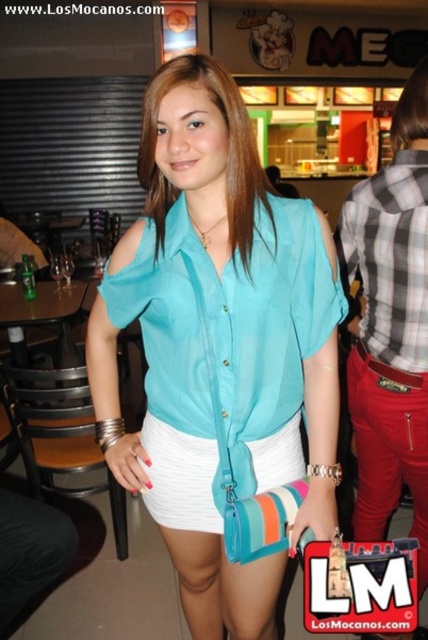
You are a fashion designer observing the image. You need to determine which fabric item is narrower between the plaid fabric shirt at right and the white fabric at center. Which one is narrower?

The plaid fabric shirt at right is narrower than the white fabric at center because it has a lesser width compared to the white fabric at center.

You are a fashion designer observing a model wearing the matte blue blouse at center and the plaid cotton shirt at right. Which clothing item is located to the left of the other?

The matte blue blouse at center is positioned on the left side of plaid cotton shirt at right, so the matte blue blouse at center is to the left of the plaid cotton shirt at right.